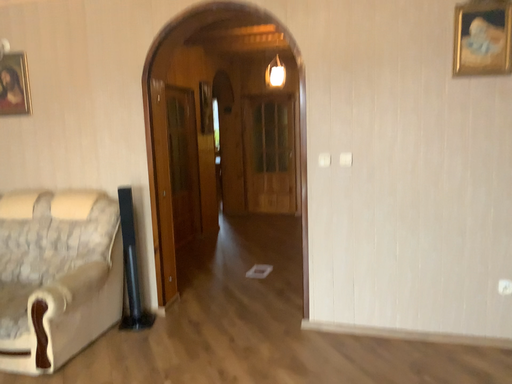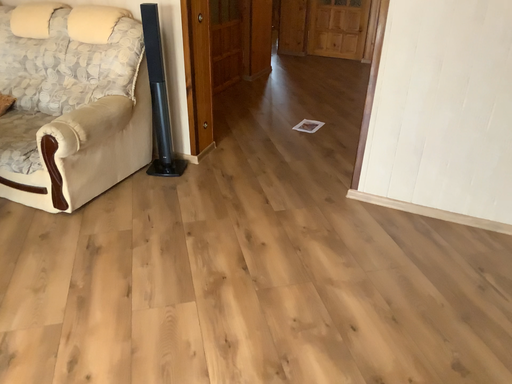
Question: How did the camera likely rotate when shooting the video?

Choices:
 (A) rotated left
 (B) rotated right

Answer: (A)